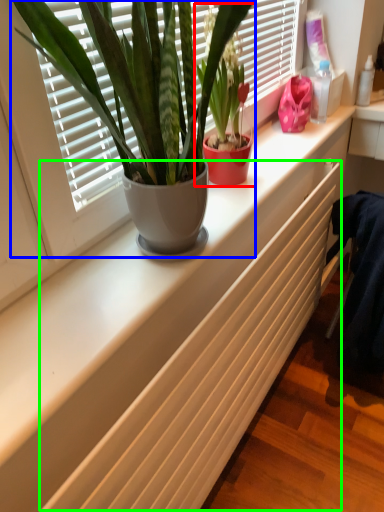
Question: Estimate the real-world distances between objects in this image. Which object is closer to houseplant (highlighted by a red box), houseplant (highlighted by a blue box) or radiator (highlighted by a green box)?

Choices:
 (A) houseplant
 (B) radiator

Answer: (A)